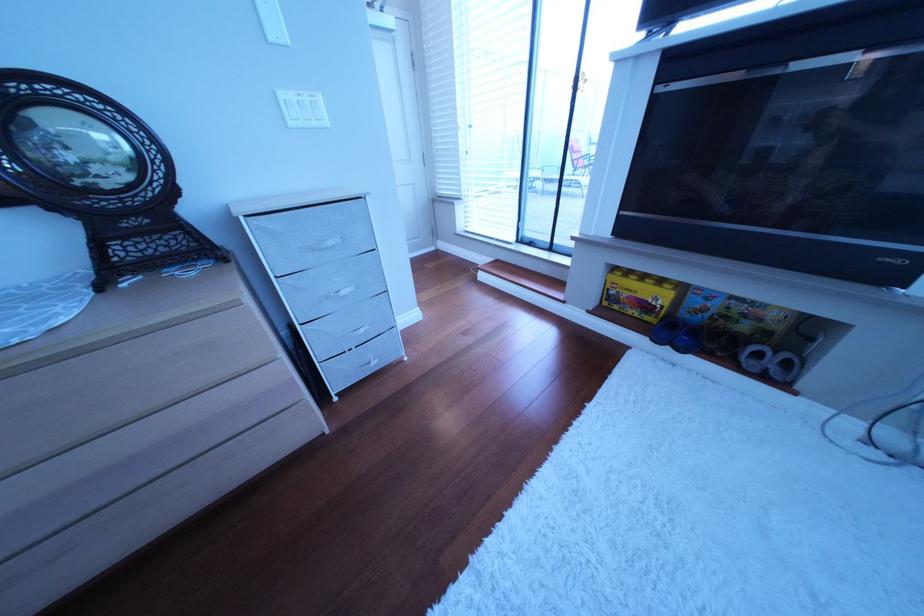
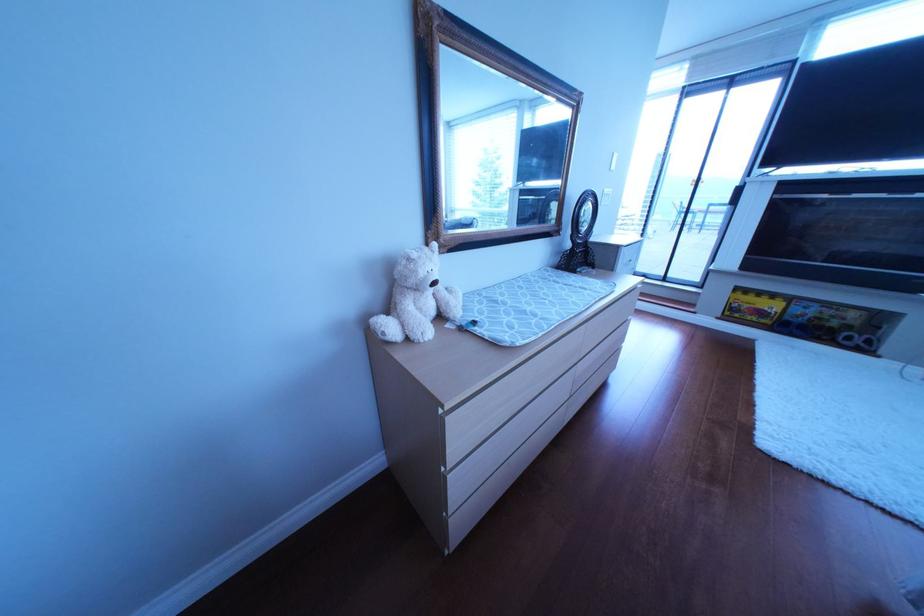
The point at (197, 203) is marked in the first image. Where is the corresponding point in the second image?

(605, 240)